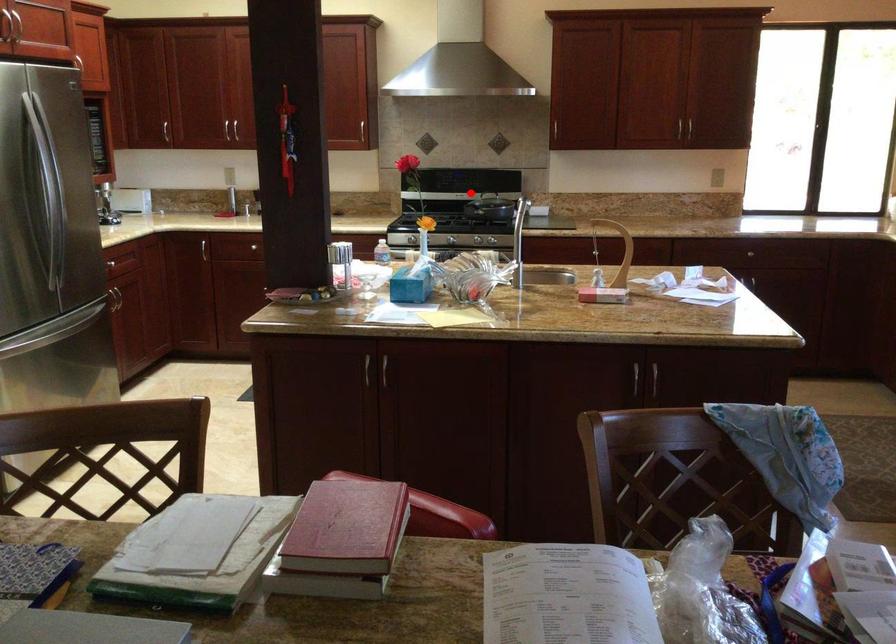
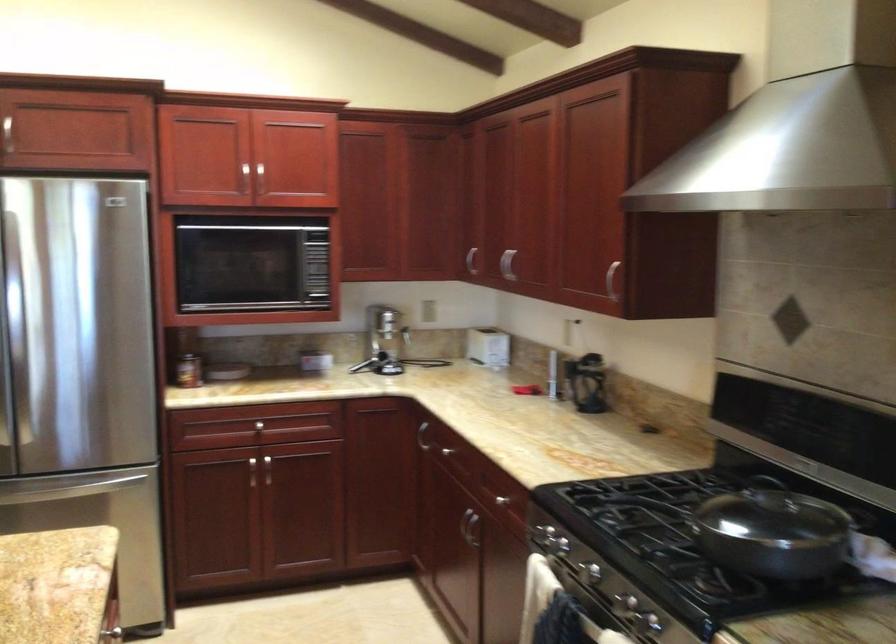
In the second image, find the point that corresponds to the highlighted location in the first image.

(800, 545)